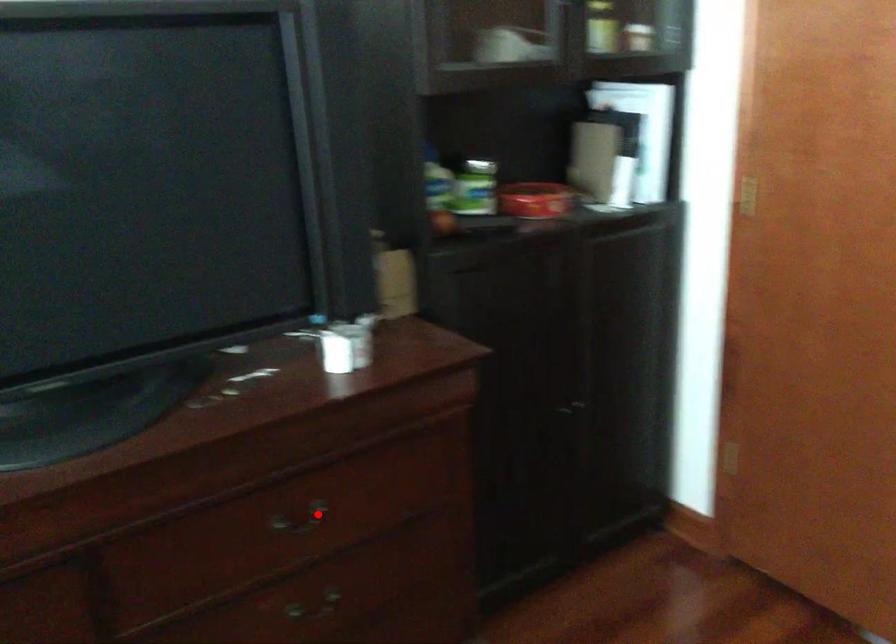
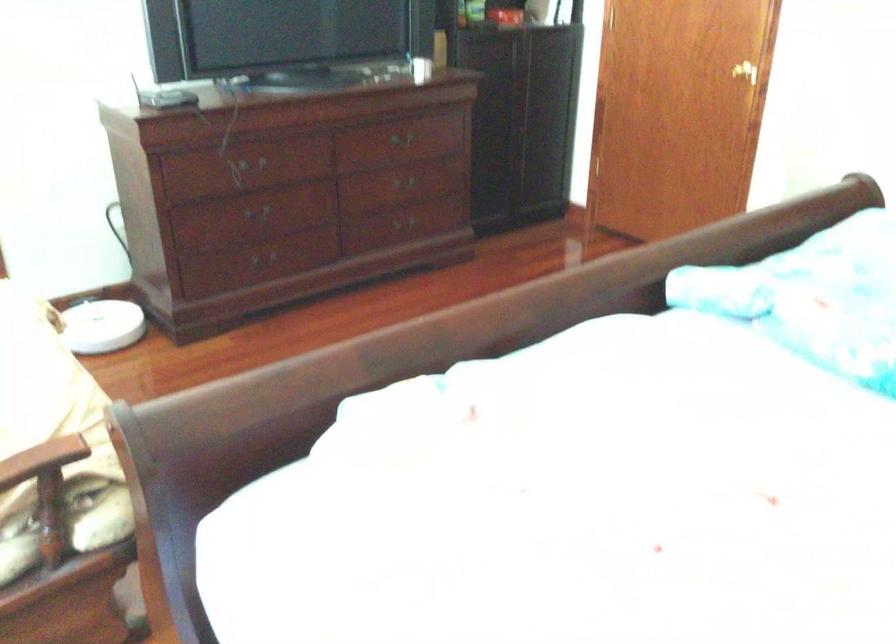
The point at the highlighted location is marked in the first image. Where is the corresponding point in the second image?

(401, 138)